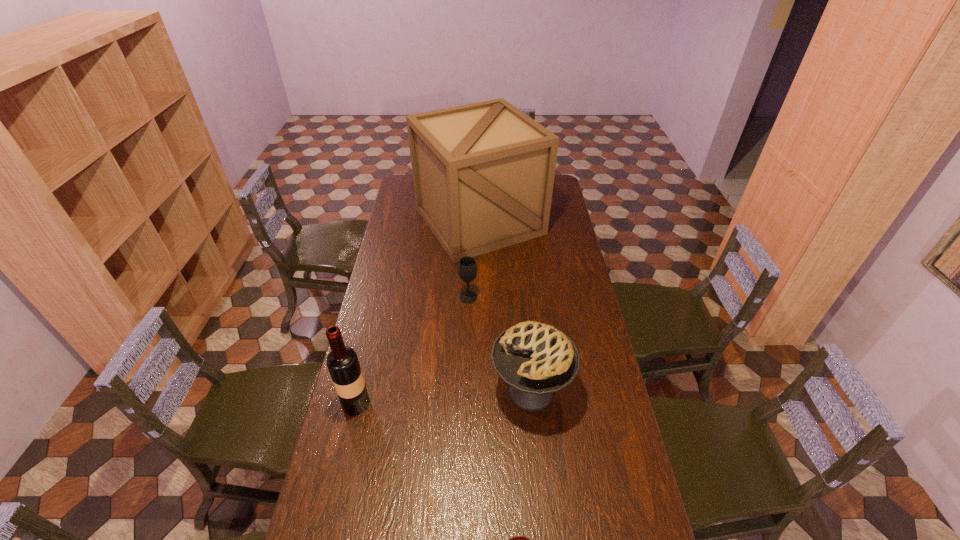
In the image, there is a desktop. Find the location of `free space at the left edge`. free space at the left edge is located at coordinates (393, 241).

Locate an element on the screen. This screenshot has height=540, width=960. vacant space at the right edge of the desktop is located at coordinates click(x=599, y=435).

Image resolution: width=960 pixels, height=540 pixels. Identify the location of vacant region at the far left corner. tap(398, 190).

The height and width of the screenshot is (540, 960). Identify the location of free space between the pie and the farthest object. (505, 306).

You are a GUI agent. You are given a task and a screenshot of the screen. Output one action in this format:
    pyautogui.click(x=<x>, y=<y>)
    Task: Click on the empty space that is in between the box and the third shortest object
    The height and width of the screenshot is (540, 960).
    Given the screenshot: What is the action you would take?
    pyautogui.click(x=505, y=306)

Where is `free spot between the wine bottle and the box`? This screenshot has width=960, height=540. free spot between the wine bottle and the box is located at coordinates tap(418, 312).

Identify the location of free space between the second shortest object and the leftmost object. (412, 350).

Identify the location of empty space between the wine bottle and the pie. (444, 397).

Identify which object is located as the second nearest to the nearest object. Please provide its 2D coordinates. Your answer should be formatted as a tuple, i.e. [(x, y)], where the tuple contains the x and y coordinates of a point satisfying the conditions above.

[(342, 362)]

Where is `the fourth closest object relative to the third tallest object`? the fourth closest object relative to the third tallest object is located at coordinates (483, 173).